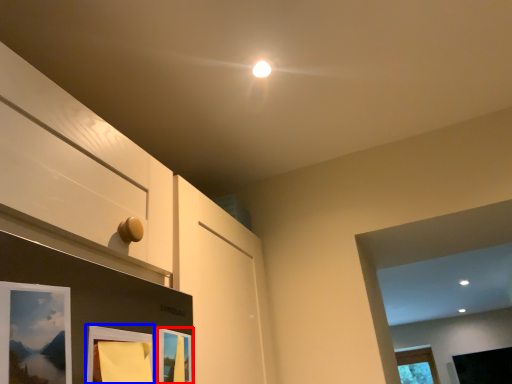
Question: Which of the following is the closest to the observer, picture frame (highlighted by a red box) or picture frame (highlighted by a blue box)?

Choices:
 (A) picture frame
 (B) picture frame

Answer: (B)